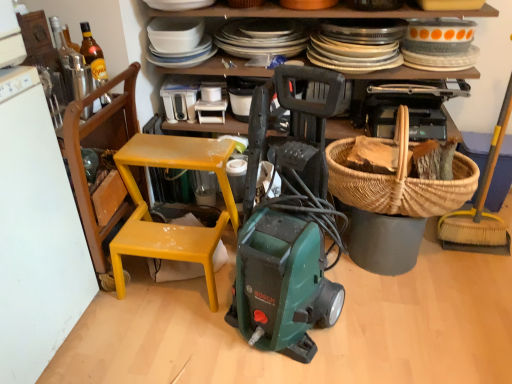
The height and width of the screenshot is (384, 512). What are the coordinates of `wooden chair at left, acting as the 1th chair starting from the left` in the screenshot? It's located at (102, 168).

This screenshot has height=384, width=512. What do you see at coordinates (323, 12) in the screenshot? I see `white glossy plates at upper center` at bounding box center [323, 12].

Find the location of a particular element. translucent glass bottle at upper left is located at coordinates (93, 56).

What do you see at coordinates (167, 224) in the screenshot?
I see `yellow plastic chair at left, the 1th chair when ordered from right to left` at bounding box center [167, 224].

Locate an element on the screen. yellow plastic chair at left, the 1th chair when ordered from right to left is located at coordinates (167, 224).

In order to face brown woven picnic basket at center right, should I rotate leftwards or rightwards?

Rotate right and turn 18.385 degrees.

Measure the distance between brown woven picnic basket at center right and camera.

brown woven picnic basket at center right is 4.34 feet from camera.

This screenshot has height=384, width=512. What do you see at coordinates (77, 75) in the screenshot?
I see `metallic glass bottle at upper left, marked as the 2th appliance in a back-to-front arrangement` at bounding box center [77, 75].

Identify the location of white plastic toaster at upper center, placed as the second appliance when sorted from front to back. (179, 101).

The width and height of the screenshot is (512, 384). What are the coordinates of `wooden chair at left, the 2th chair positioned from the right` in the screenshot? It's located at (102, 168).

How many degrees apart are the facing directions of yellow plastic chair at left, the 1th chair when ordered from right to left, and brown woven picnic basket at center right?

The angular difference between yellow plastic chair at left, the 1th chair when ordered from right to left, and brown woven picnic basket at center right is 0.563 degrees.

In the scene shown: Does yellow plastic chair at left, marked as the second chair in a left-to-right arrangement, turn towards brown woven picnic basket at center right?

No, yellow plastic chair at left, marked as the second chair in a left-to-right arrangement, is not turned towards brown woven picnic basket at center right.

From a real-world perspective, is yellow plastic chair at left, the 1th chair when ordered from right to left, physically below brown woven picnic basket at center right?

Yes, from a real-world perspective, yellow plastic chair at left, the 1th chair when ordered from right to left, is beneath brown woven picnic basket at center right.

Where is `bottle on the left of white glossy plates at upper center`? This screenshot has width=512, height=384. bottle on the left of white glossy plates at upper center is located at coordinates pos(93,56).

From the image's perspective, is white glossy plates at upper center under translucent glass bottle at upper left?

No.

From a real-world perspective, which is physically below, white glossy plates at upper center or translucent glass bottle at upper left?

In real-world perspective, translucent glass bottle at upper left is lower.

Is the depth of white glossy plates at upper center greater than that of translucent glass bottle at upper left?

Yes, it is behind translucent glass bottle at upper left.

At what (x,y) coordinates should I click in order to perform the action: click on bottle behind the brown woven picnic basket at center right. Please return your answer as a coordinate pair (x, y). Looking at the image, I should click on (93, 56).

Is point (369, 173) positioned after point (94, 63)?

Yes.

Is brown woven picnic basket at center right oriented towards translucent glass bottle at upper left?

No, brown woven picnic basket at center right is not turned towards translucent glass bottle at upper left.

Can you confirm if brown woven picnic basket at center right is bigger than translucent glass bottle at upper left?

Yes.

Which object is positioned more to the right, white plastic toaster at upper center, which is counted as the first appliance, starting from the right, or white glossy plates at upper center?

white glossy plates at upper center.

Looking at this image, does white plastic toaster at upper center, placed as the second appliance when sorted from front to back, have a smaller size compared to white glossy plates at upper center?

Indeed, white plastic toaster at upper center, placed as the second appliance when sorted from front to back, has a smaller size compared to white glossy plates at upper center.

Is white plastic toaster at upper center, placed as the second appliance when sorted from front to back, oriented away from white glossy plates at upper center?

That's not correct — white plastic toaster at upper center, placed as the second appliance when sorted from front to back, is not looking away from white glossy plates at upper center.

From the image's perspective, would you say white plastic toaster at upper center, placed as the second appliance when sorted from front to back, is positioned over white glossy plates at upper center?

No, from the image's perspective, white plastic toaster at upper center, placed as the second appliance when sorted from front to back, is not above white glossy plates at upper center.

From the image's perspective, is brown woven picnic basket at center right positioned above or below wooden chair at left, acting as the 1th chair starting from the left?

Clearly, from the image's perspective, brown woven picnic basket at center right is above wooden chair at left, acting as the 1th chair starting from the left.

Is wooden chair at left, acting as the 1th chair starting from the left, a part of brown woven picnic basket at center right?

No, brown woven picnic basket at center right does not contain wooden chair at left, acting as the 1th chair starting from the left.

Considering the sizes of objects brown woven picnic basket at center right and wooden chair at left, the 2th chair positioned from the right, in the image provided, who is bigger, brown woven picnic basket at center right or wooden chair at left, the 2th chair positioned from the right,?

wooden chair at left, the 2th chair positioned from the right.

Would you consider brown woven picnic basket at center right to be distant from wooden chair at left, acting as the 1th chair starting from the left?

brown woven picnic basket at center right is near wooden chair at left, acting as the 1th chair starting from the left, not far away.

Does wooden chair at left, acting as the 1th chair starting from the left, appear on the right side of white plastic toaster at upper center, which is the 2th appliance in left-to-right order?

Incorrect, wooden chair at left, acting as the 1th chair starting from the left, is not on the right side of white plastic toaster at upper center, which is the 2th appliance in left-to-right order.

Does point (139, 69) appear closer or farther from the camera than point (197, 92)?

Clearly, point (139, 69) is closer to the camera than point (197, 92).

What's the angular difference between wooden chair at left, acting as the 1th chair starting from the left, and white plastic toaster at upper center, positioned as the 1th appliance in back-to-front order,'s facing directions?

89.7 degrees separate the facing orientations of wooden chair at left, acting as the 1th chair starting from the left, and white plastic toaster at upper center, positioned as the 1th appliance in back-to-front order.

Is wooden chair at left, acting as the 1th chair starting from the left, oriented away from white glossy plates at upper center?

No, white glossy plates at upper center is not at the back of wooden chair at left, acting as the 1th chair starting from the left.

Can you tell me how much wooden chair at left, acting as the 1th chair starting from the left, and white glossy plates at upper center differ in facing direction?

The facing directions of wooden chair at left, acting as the 1th chair starting from the left, and white glossy plates at upper center are 88.9 degrees apart.

From a real-world perspective, which object rests below the other?

wooden chair at left, the 2th chair positioned from the right.

Considering the relative sizes of wooden chair at left, the 2th chair positioned from the right, and white glossy plates at upper center in the image provided, is wooden chair at left, the 2th chair positioned from the right, taller than white glossy plates at upper center?

Yes, wooden chair at left, the 2th chair positioned from the right, is taller than white glossy plates at upper center.

You are a GUI agent. You are given a task and a screenshot of the screen. Output one action in this format:
    pyautogui.click(x=<x>, y=<y>)
    Task: Click on the 2nd chair positioned below the brown woven picnic basket at center right (from the image's perspective)
    The width and height of the screenshot is (512, 384).
    Given the screenshot: What is the action you would take?
    pyautogui.click(x=167, y=224)

At what (x,y) coordinates should I click in order to perform the action: click on shelf above the translucent glass bottle at upper left (from a real-world perspective). Please return your answer as a coordinate pair (x, y). This screenshot has height=384, width=512. Looking at the image, I should click on (323, 12).

Estimate the real-world distances between objects in this image. Which object is further from yellow plastic chair at left, the 1th chair when ordered from right to left, brown woven picnic basket at center right or white plastic toaster at upper center, positioned as the 1th appliance in back-to-front order?

brown woven picnic basket at center right.

Looking at the image, which one is located further to yellow plastic chair at left, marked as the second chair in a left-to-right arrangement, white plastic toaster at upper center, which is counted as the first appliance, starting from the right, or brown woven picnic basket at center right?

brown woven picnic basket at center right.

Considering their positions, is wooden chair at left, the 2th chair positioned from the right, positioned further to white glossy plates at upper center than yellow plastic chair at left, marked as the second chair in a left-to-right arrangement?

wooden chair at left, the 2th chair positioned from the right.

Based on their spatial positions, is metallic glass bottle at upper left, the first appliance viewed from the left, or translucent glass bottle at upper left closer to brown woven picnic basket at center right?

translucent glass bottle at upper left lies closer to brown woven picnic basket at center right than the other object.

When comparing their distances from yellow plastic chair at left, the 1th chair when ordered from right to left, does translucent glass bottle at upper left or brown woven picnic basket at center right seem closer?

translucent glass bottle at upper left lies closer to yellow plastic chair at left, the 1th chair when ordered from right to left, than the other object.

Based on their spatial positions, is translucent glass bottle at upper left or yellow plastic chair at left, the 1th chair when ordered from right to left, closer to metallic glass bottle at upper left, marked as the 1th appliance in a front-to-back arrangement?

The object closer to metallic glass bottle at upper left, marked as the 1th appliance in a front-to-back arrangement, is translucent glass bottle at upper left.

Which object lies further to the anchor point metallic glass bottle at upper left, the first appliance viewed from the left, wooden chair at left, the 2th chair positioned from the right, or yellow plastic chair at left, the 1th chair when ordered from right to left?

Based on the image, yellow plastic chair at left, the 1th chair when ordered from right to left, appears to be further to metallic glass bottle at upper left, the first appliance viewed from the left.

Looking at this image, from the image, which object appears to be farther from yellow plastic chair at left, marked as the second chair in a left-to-right arrangement, brown woven picnic basket at center right or wooden chair at left, acting as the 1th chair starting from the left?

brown woven picnic basket at center right is positioned further to the anchor yellow plastic chair at left, marked as the second chair in a left-to-right arrangement.

The width and height of the screenshot is (512, 384). Identify the location of bottle located between wooden chair at left, acting as the 1th chair starting from the left, and white plastic toaster at upper center, placed as the second appliance when sorted from front to back, in the depth direction. (93, 56).

Where is `chair located between translucent glass bottle at upper left and brown woven picnic basket at center right in the left-right direction`? Image resolution: width=512 pixels, height=384 pixels. chair located between translucent glass bottle at upper left and brown woven picnic basket at center right in the left-right direction is located at coordinates (167, 224).

The image size is (512, 384). I want to click on chair situated between white plastic toaster at upper center, placed as the second appliance when sorted from front to back, and brown woven picnic basket at center right from left to right, so coord(167,224).

The width and height of the screenshot is (512, 384). Find the location of `shelf located between metallic glass bottle at upper left, the first appliance viewed from the left, and brown woven picnic basket at center right in the left-right direction`. shelf located between metallic glass bottle at upper left, the first appliance viewed from the left, and brown woven picnic basket at center right in the left-right direction is located at coordinates (323, 12).